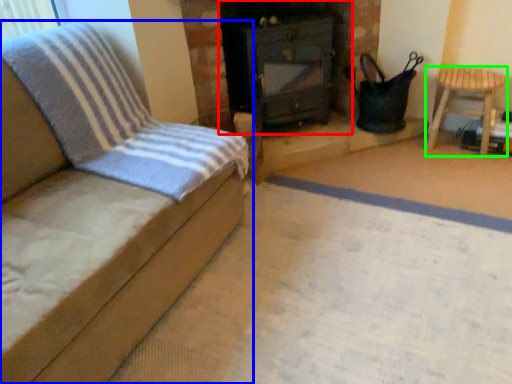
Question: Considering the real-world distances, which object is farthest from stove (highlighted by a red box)? furniture (highlighted by a blue box) or furniture (highlighted by a green box)?

Choices:
 (A) furniture
 (B) furniture

Answer: (A)